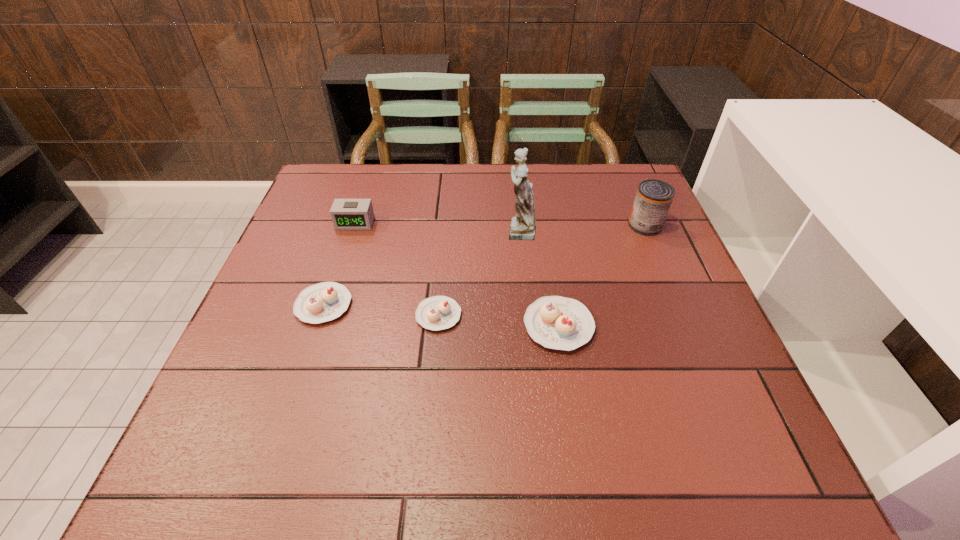
The image size is (960, 540). Identify the location of the fifth tallest object. (326, 301).

Where is `the second shortest cupcake`? This screenshot has width=960, height=540. the second shortest cupcake is located at coordinates (326, 301).

In order to click on the third object from left to right in this screenshot , I will do click(x=435, y=313).

At what (x,y) coordinates should I click in order to perform the action: click on the second cupcake from right to left. Please return your answer as a coordinate pair (x, y). Looking at the image, I should click on (435, 313).

Where is `the tallest cupcake`? the tallest cupcake is located at coordinates (555, 322).

What are the coordinates of `alarm clock` in the screenshot? It's located at (347, 214).

Identify the location of figurine. (522, 227).

This screenshot has width=960, height=540. I want to click on the fifth shortest object, so click(x=653, y=199).

This screenshot has height=540, width=960. I want to click on can, so click(x=653, y=199).

Where is `vacant area situated 0.120m on the right of the second shortest object`? Image resolution: width=960 pixels, height=540 pixels. vacant area situated 0.120m on the right of the second shortest object is located at coordinates (405, 305).